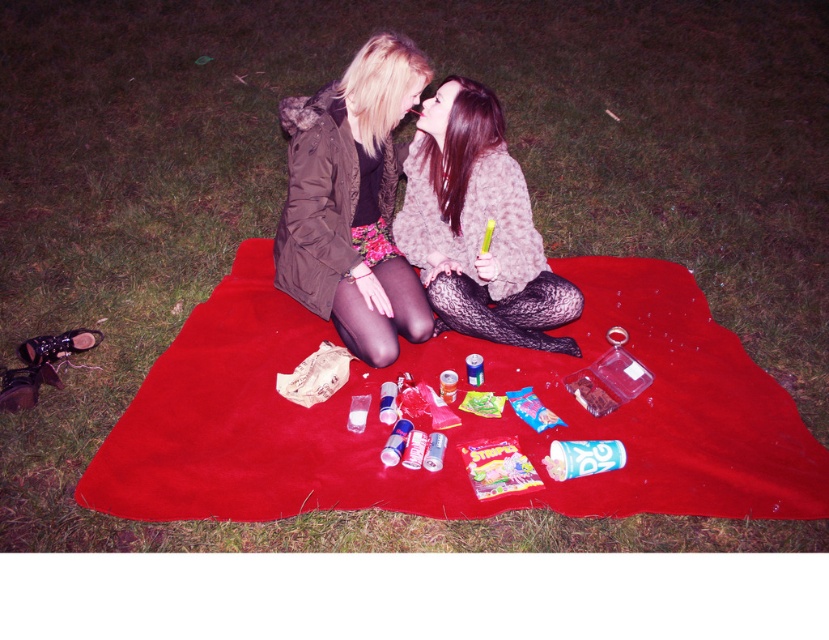
Does red suede blanket at center have a smaller size compared to fuzzy pink sweater at center?

No.

At what (x,y) coordinates should I click in order to perform the action: click on red suede blanket at center. Please return your answer as a coordinate pair (x, y). Looking at the image, I should click on (456, 412).

Does point (280, 480) come in front of point (420, 198)?

Yes.

This screenshot has width=829, height=640. I want to click on red suede blanket at center, so click(x=456, y=412).

Is matte brown jacket at center thinner than fuzzy pink sweater at center?

Yes, matte brown jacket at center is thinner than fuzzy pink sweater at center.

Who is more distant from viewer, (393, 353) or (430, 154)?

Positioned behind is point (430, 154).

Does point (347, 346) lie in front of point (495, 323)?

That is True.

Locate an element on the screen. matte brown jacket at center is located at coordinates (352, 202).

What do you see at coordinates (456, 412) in the screenshot?
I see `red suede blanket at center` at bounding box center [456, 412].

This screenshot has width=829, height=640. I want to click on red suede blanket at center, so click(x=456, y=412).